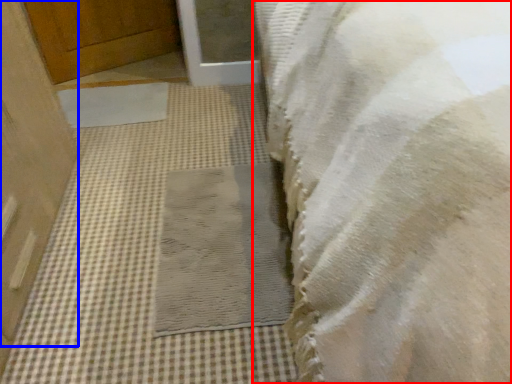
Question: Which object appears farthest to the camera in this image, towel (highlighted by a red box) or door (highlighted by a blue box)?

Choices:
 (A) towel
 (B) door

Answer: (B)